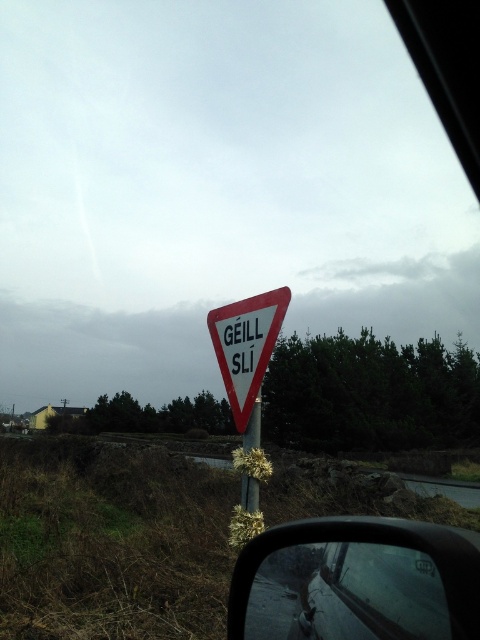
In the scene shown: Can you confirm if white plastic triangle at center is bigger than metallic pole at center?

Yes, white plastic triangle at center is bigger than metallic pole at center.

Can you confirm if white plastic triangle at center is wider than metallic pole at center?

Yes, white plastic triangle at center is wider than metallic pole at center.

Where is `white plastic triangle at center`? This screenshot has height=640, width=480. white plastic triangle at center is located at coordinates (247, 346).

I want to click on white plastic triangle at center, so click(247, 346).

Can you confirm if black plastic side mirror at lower right is thinner than metallic pole at center?

No, black plastic side mirror at lower right is not thinner than metallic pole at center.

Who is lower down, black plastic side mirror at lower right or metallic pole at center?

metallic pole at center is lower down.

Measure the distance between point (x=352, y=604) and camera.

The distance of point (x=352, y=604) from camera is 3.92 feet.

At what (x,y) coordinates should I click in order to perform the action: click on black plastic side mirror at lower right. Please return your answer as a coordinate pair (x, y). The height and width of the screenshot is (640, 480). Looking at the image, I should click on (357, 580).

Who is more distant from viewer, (388,586) or (249,326)?

The point (249,326) is more distant.

Does black plastic side mirror at lower right have a lesser height compared to white plastic triangle at center?

Indeed, black plastic side mirror at lower right has a lesser height compared to white plastic triangle at center.

Who is more forward, (324, 538) or (224, 332)?

Point (324, 538) is more forward.

You are a GUI agent. You are given a task and a screenshot of the screen. Output one action in this format:
    pyautogui.click(x=<x>, y=<y>)
    Task: Click on the black plastic side mirror at lower right
    
    Given the screenshot: What is the action you would take?
    pyautogui.click(x=357, y=580)